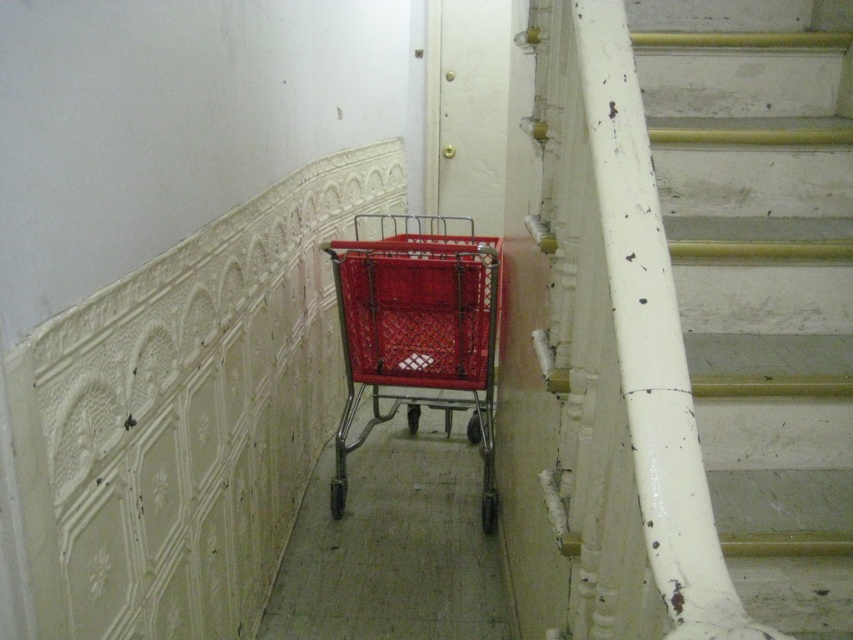
Which is more to the left, white painted wood stairs at right or red plastic shopping cart at center?

From the viewer's perspective, red plastic shopping cart at center appears more on the left side.

Which is behind, point (750, 364) or point (329, 248)?

The point (329, 248) is behind.

Is point (682, 154) more distant than point (350, 292)?

No.

Find the location of a particular element. white painted wood stairs at right is located at coordinates (682, 320).